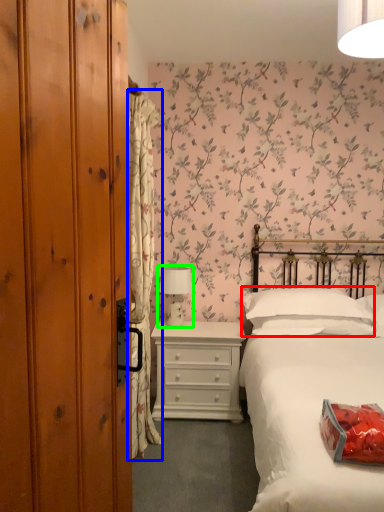
Question: Which object is the farthest from pillow (highlighted by a red box)? Choose among these: curtain (highlighted by a blue box) or table lamp (highlighted by a green box).

Choices:
 (A) curtain
 (B) table lamp

Answer: (A)